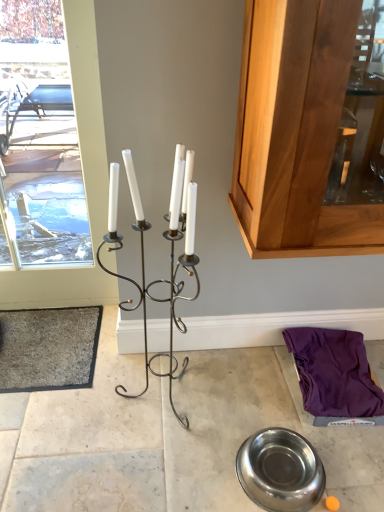
You are a GUI agent. You are given a task and a screenshot of the screen. Output one action in this format:
    pyautogui.click(x=<x>, y=<y>)
    Task: Click on the vacant area situated to the left side of polished stainless steel bowl at lower center
    
    Given the screenshot: What is the action you would take?
    pyautogui.click(x=200, y=462)